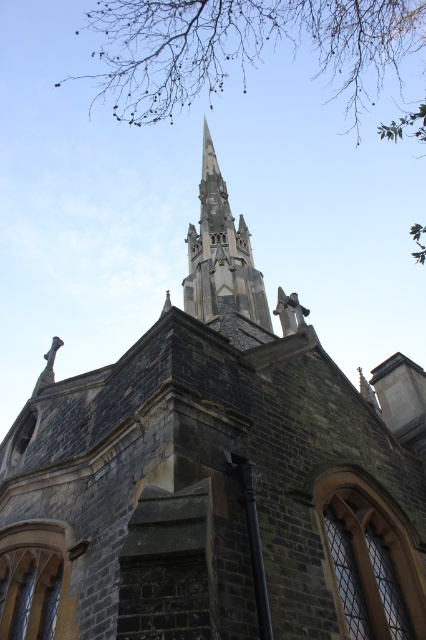
Between brown leafy branches at upper center and smooth gray stone spire at upper center, which one is positioned higher?

brown leafy branches at upper center is higher up.

What do you see at coordinates (242, 45) in the screenshot?
I see `brown leafy branches at upper center` at bounding box center [242, 45].

Locate an element on the screen. brown leafy branches at upper center is located at coordinates (242, 45).